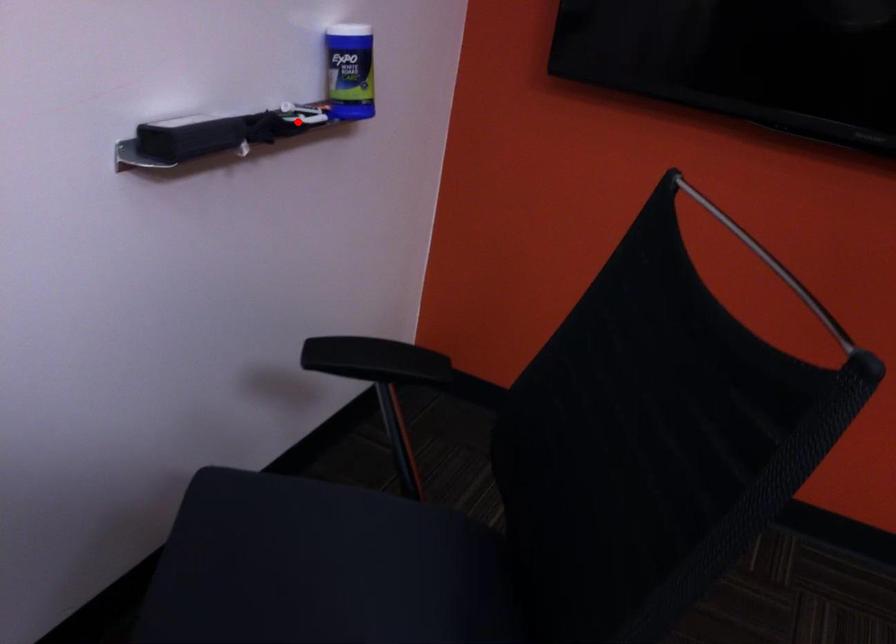
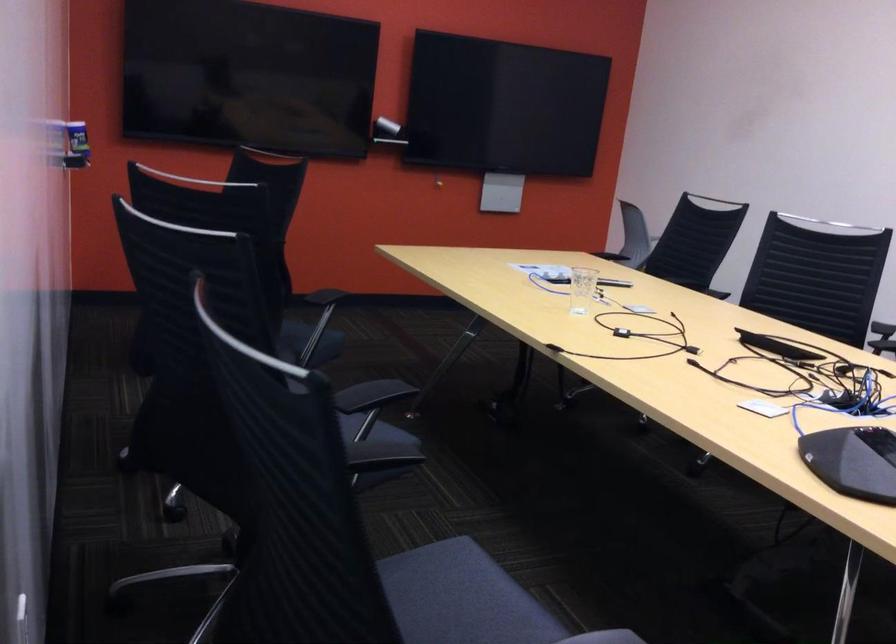
In the second image, find the point that corresponds to the highlighted location in the first image.

(76, 145)